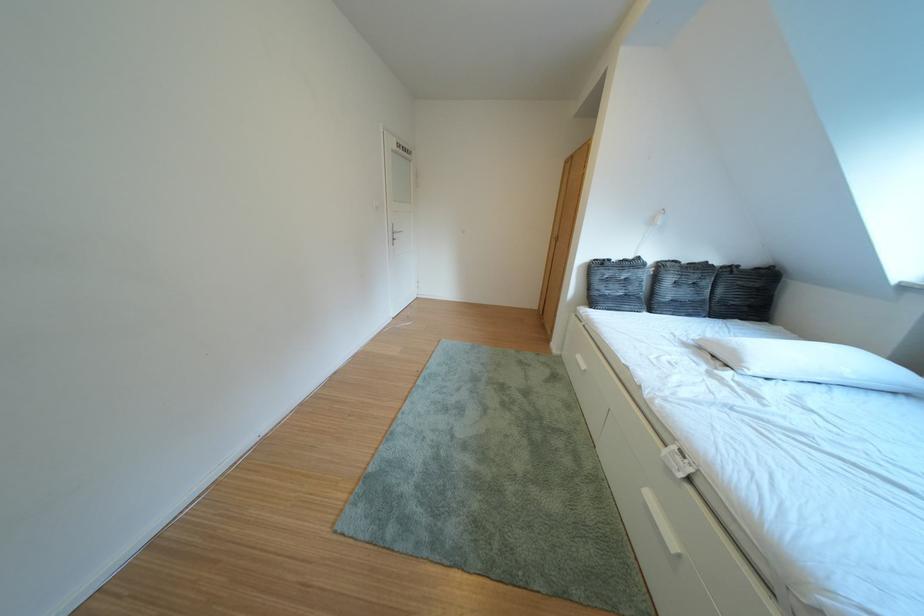
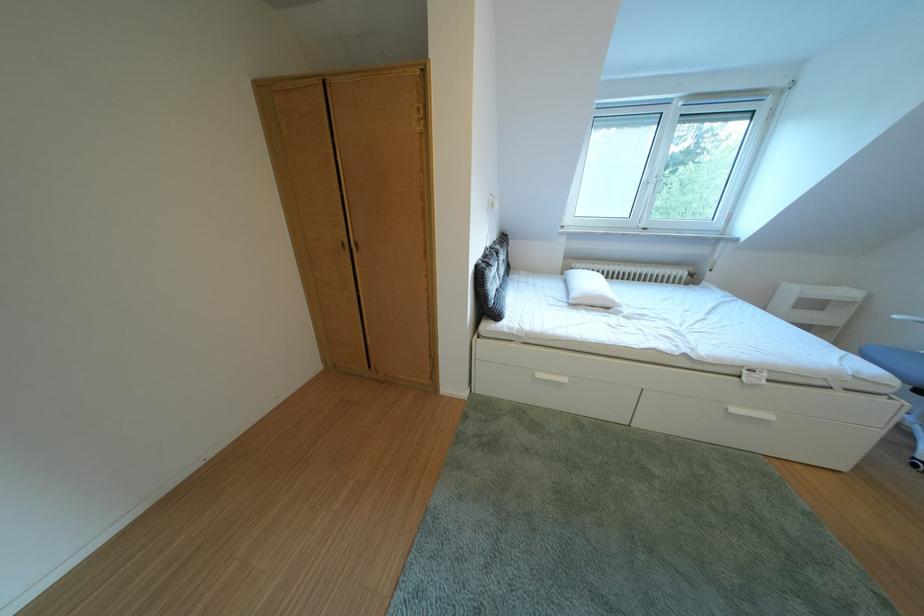
Locate, in the second image, the point that corresponds to (592,362) in the first image.

(553, 381)